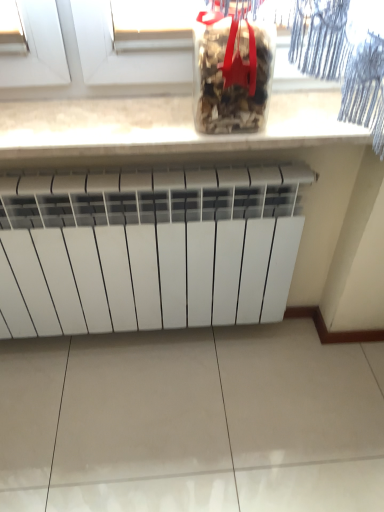
Where is `vacant space situated on the left part of transparent plastic container at upper center`? vacant space situated on the left part of transparent plastic container at upper center is located at coordinates (149, 117).